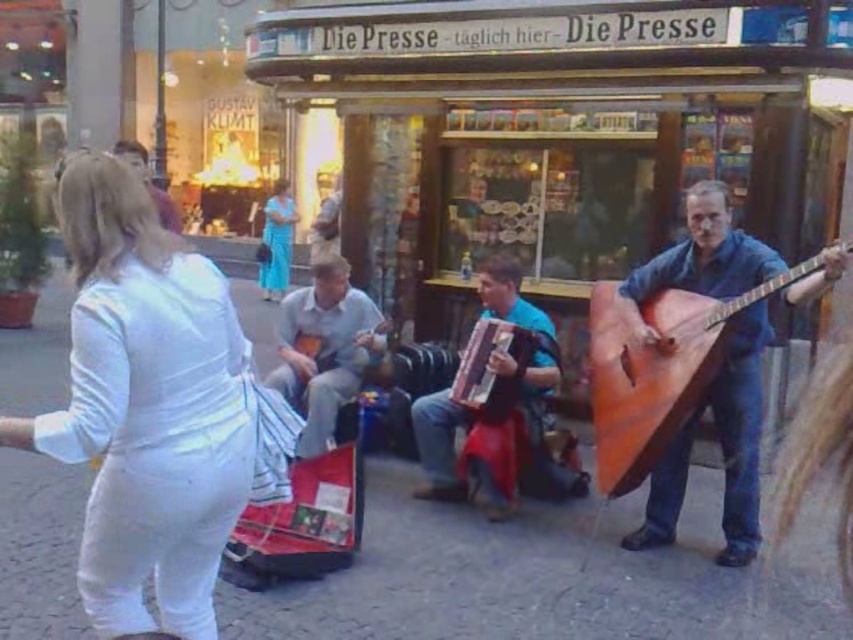
You are a photographer trying to capture both the blue fabric accordion at center and the blue silk dress at center in the same frame. Since you want the dress to be the focus, which object should you adjust your camera angle to prioritize in terms of height?

Answer: The blue fabric accordion at center is shorter than the blue silk dress at center. To prioritize the dress, you should angle your camera slightly upward to emphasize its height advantage over the accordion.

You are a street performer who just finished your set and need to retrieve your blue fabric accordion at center from the stage. You are currently standing 10 feet away from where you were performing. Can you reach your accordion without moving closer?

The blue fabric accordion at center is 13.67 feet away from the viewer. Since you are 10 feet away from your performance spot, you are still 3.67 feet away from the accordion and would need to move closer to reach it.